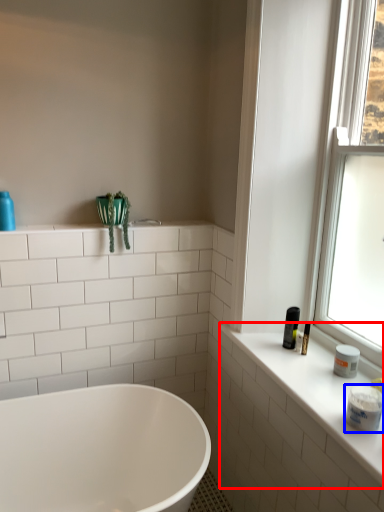
Question: Which point is further to the camera, counter top (highlighted by a red box) or toiletry (highlighted by a blue box)?

Choices:
 (A) counter top
 (B) toiletry

Answer: (B)